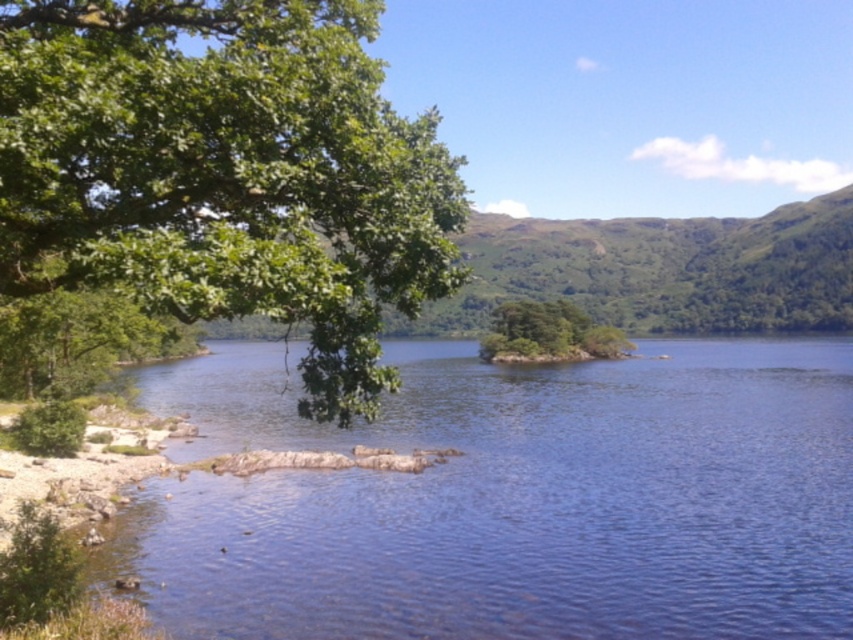
Consider the image. Is the position of green leafy tree at upper left less distant than that of green leafy island at center?

Yes, it is.

Does green leafy tree at upper left appear over green leafy island at center?

Indeed, green leafy tree at upper left is positioned over green leafy island at center.

Between point (321, 355) and point (526, 323), which one is positioned in front?

Point (321, 355)

Find the location of a particular element. green leafy tree at upper left is located at coordinates (225, 172).

Does clear water at lower left have a lesser width compared to green leafy island at center?

No, clear water at lower left is not thinner than green leafy island at center.

Who is positioned more to the left, clear water at lower left or green leafy island at center?

clear water at lower left

Who is more distant from viewer, [297,564] or [489,353]?

The point [489,353] is behind.

Image resolution: width=853 pixels, height=640 pixels. I want to click on clear water at lower left, so click(514, 499).

Can you confirm if clear water at lower left is thinner than green leafy tree at upper left?

In fact, clear water at lower left might be wider than green leafy tree at upper left.

Which is above, clear water at lower left or green leafy tree at upper left?

green leafy tree at upper left

Between point (573, 472) and point (335, 163), which one is positioned in front?

Point (335, 163) is in front.

You are a GUI agent. You are given a task and a screenshot of the screen. Output one action in this format:
    pyautogui.click(x=<x>, y=<y>)
    Task: Click on the clear water at lower left
    The width and height of the screenshot is (853, 640).
    Given the screenshot: What is the action you would take?
    pyautogui.click(x=514, y=499)